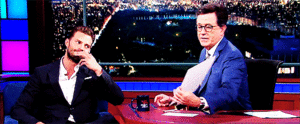
Locate an element on the screen. red part of the desk is located at coordinates (227, 120).